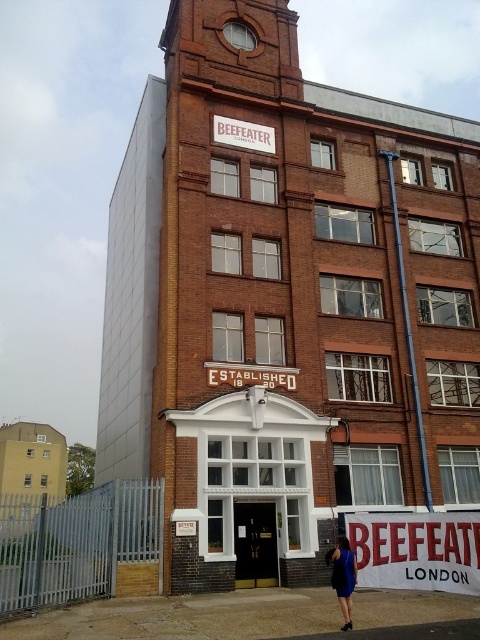
Does white fabric sign at lower center have a smaller size compared to white painted wood sign at center?

Actually, white fabric sign at lower center might be larger than white painted wood sign at center.

Does white fabric sign at lower center come in front of white painted wood sign at center?

Yes, it is in front of white painted wood sign at center.

Consider the image. Who is more forward, (x=405, y=513) or (x=296, y=381)?

Point (x=405, y=513) is more forward.

Image resolution: width=480 pixels, height=640 pixels. In order to click on white fabric sign at lower center in this screenshot , I will do `click(417, 550)`.

Who is shorter, white painted wood sign at center or white wooden sign at upper center?

white painted wood sign at center is shorter.

Can you confirm if white painted wood sign at center is thinner than white wooden sign at upper center?

No, white painted wood sign at center is not thinner than white wooden sign at upper center.

Who is more forward, (229, 369) or (242, 129)?

Point (229, 369)

Where is `white painted wood sign at center`? The height and width of the screenshot is (640, 480). white painted wood sign at center is located at coordinates (252, 376).

Does white fabric sign at lower center appear on the right side of blue fabric dress at lower center?

Correct, you'll find white fabric sign at lower center to the right of blue fabric dress at lower center.

Does white fabric sign at lower center have a greater width compared to blue fabric dress at lower center?

Yes.

I want to click on white fabric sign at lower center, so click(x=417, y=550).